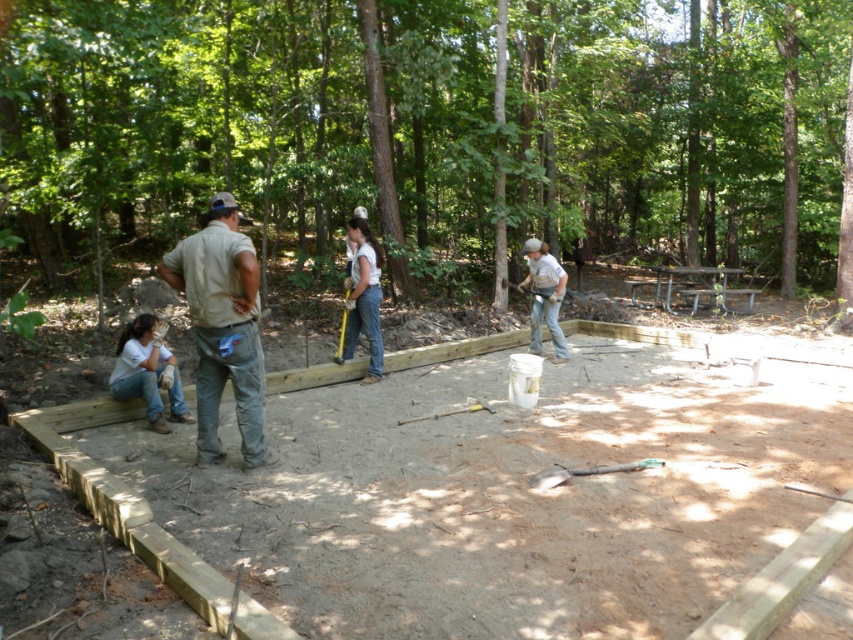
Question: Which point is closer to the camera taking this photo?

Choices:
 (A) (556, 481)
 (B) (548, 314)
 (C) (123, 544)
 (D) (219, 278)

Answer: (C)

Question: In this image, where is white cotton shirt at lower left located relative to matte gray shirt at center?

Choices:
 (A) below
 (B) above

Answer: (A)

Question: Which object appears farthest from the camera in this image?

Choices:
 (A) white cotton shirt at lower left
 (B) light brown wood at center
 (C) matte gray shirt at center
 (D) green plastic shovel at lower center

Answer: (C)

Question: Which point is farther from the camera taking this photo?

Choices:
 (A) (537, 321)
 (B) (194, 324)
 (C) (601, 467)

Answer: (A)

Question: Is light brown wood at center to the left of green plastic shovel at lower center from the viewer's perspective?

Choices:
 (A) no
 (B) yes

Answer: (B)

Question: Can you confirm if light brown wood at center is positioned to the left of white cotton shirt at lower left?

Choices:
 (A) no
 (B) yes

Answer: (A)